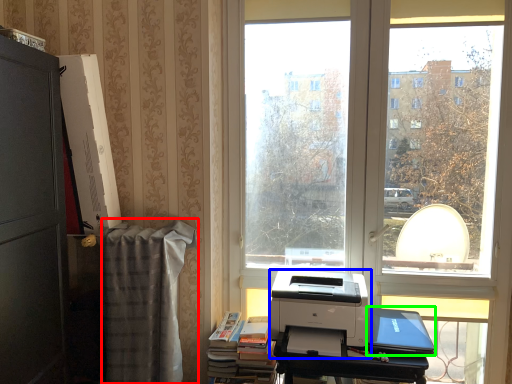
Question: Which object is the closest to the blanket (highlighted by a red box)? Choose among these: printer (highlighted by a blue box) or laptop (highlighted by a green box).

Choices:
 (A) printer
 (B) laptop

Answer: (A)